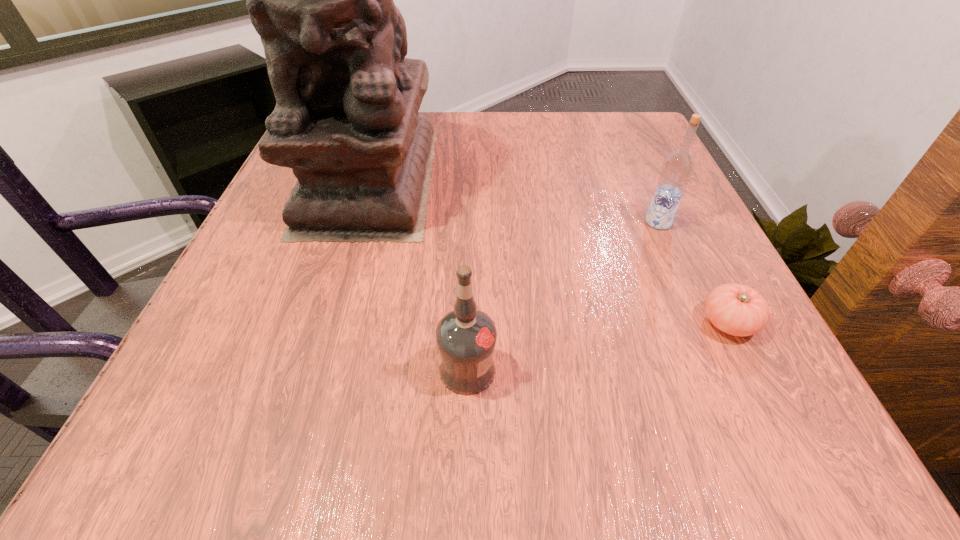
The width and height of the screenshot is (960, 540). Find the location of `unoccupied position between the tallest object and the nearest object`. unoccupied position between the tallest object and the nearest object is located at coordinates (420, 274).

Where is `free space between the tallest object and the third farthest object`? This screenshot has height=540, width=960. free space between the tallest object and the third farthest object is located at coordinates (549, 251).

Identify the location of object that is the third closest to the second nearest object. This screenshot has height=540, width=960. (346, 120).

Identify which object is the third closest to the right vodka. Please provide its 2D coordinates. Your answer should be formatted as a tuple, i.e. [(x, y)], where the tuple contains the x and y coordinates of a point satisfying the conditions above.

[(346, 120)]

Find the location of a particular element. blank area in the image that satisfies the following two spatial constraints: 1. on the front-facing side of the tomato; 2. on the left side of the tallest object is located at coordinates (326, 322).

Image resolution: width=960 pixels, height=540 pixels. I want to click on vacant space that satisfies the following two spatial constraints: 1. on the front-facing side of the second nearest object; 2. on the right side of the tallest object, so click(326, 322).

This screenshot has width=960, height=540. In order to click on vacant position in the image that satisfies the following two spatial constraints: 1. on the front-facing side of the sculpture; 2. on the left side of the third farthest object in this screenshot , I will do `click(326, 322)`.